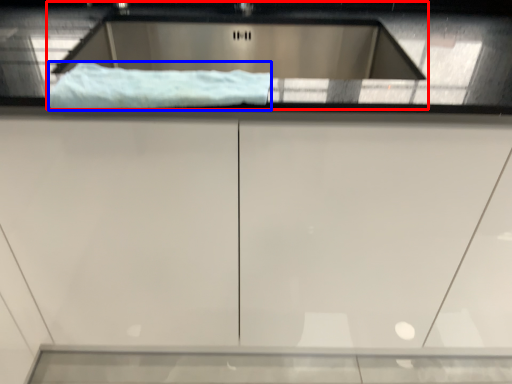
Question: Which of the following is the farthest to the observer, sink (highlighted by a red box) or material (highlighted by a blue box)?

Choices:
 (A) sink
 (B) material

Answer: (A)